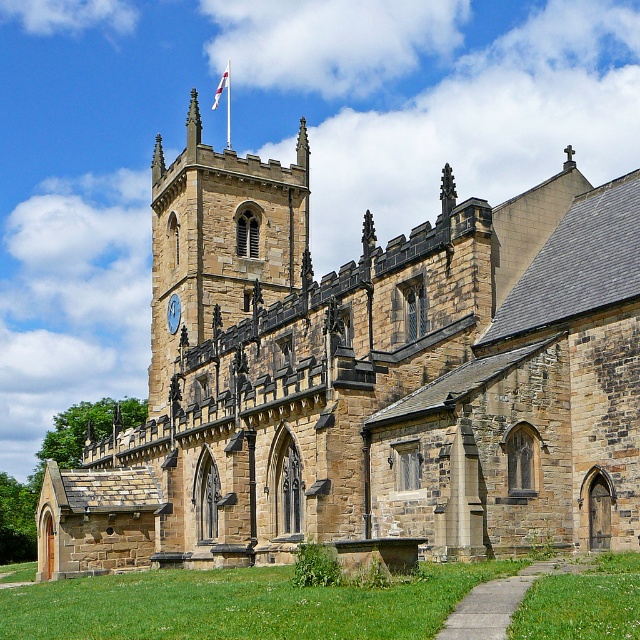
Does point (170, 314) come in front of point (216, 99)?

Yes, it is.

Describe the element at coordinates (173, 314) in the screenshot. The height and width of the screenshot is (640, 640). I see `blue stone clock at center` at that location.

Does point (166, 317) lie behind point (216, 99)?

No, it is not.

I want to click on blue stone clock at center, so click(173, 314).

Does brown stone church at center have a greater width compared to stone clock tower at upper center?

Yes, brown stone church at center is wider than stone clock tower at upper center.

Which is behind, point (298, 246) or point (273, 275)?

The point (298, 246) is more distant.

Where is `brown stone church at center`? This screenshot has height=640, width=640. brown stone church at center is located at coordinates (368, 380).

Is stone clock tower at upper center positioned behind white fabric flag at upper center?

That is False.

Can you confirm if stone clock tower at upper center is smaller than white fabric flag at upper center?

Incorrect, stone clock tower at upper center is not smaller in size than white fabric flag at upper center.

Where is `stone clock tower at upper center`? This screenshot has width=640, height=640. stone clock tower at upper center is located at coordinates (220, 240).

Where is `stone clock tower at upper center`? The height and width of the screenshot is (640, 640). stone clock tower at upper center is located at coordinates (220, 240).